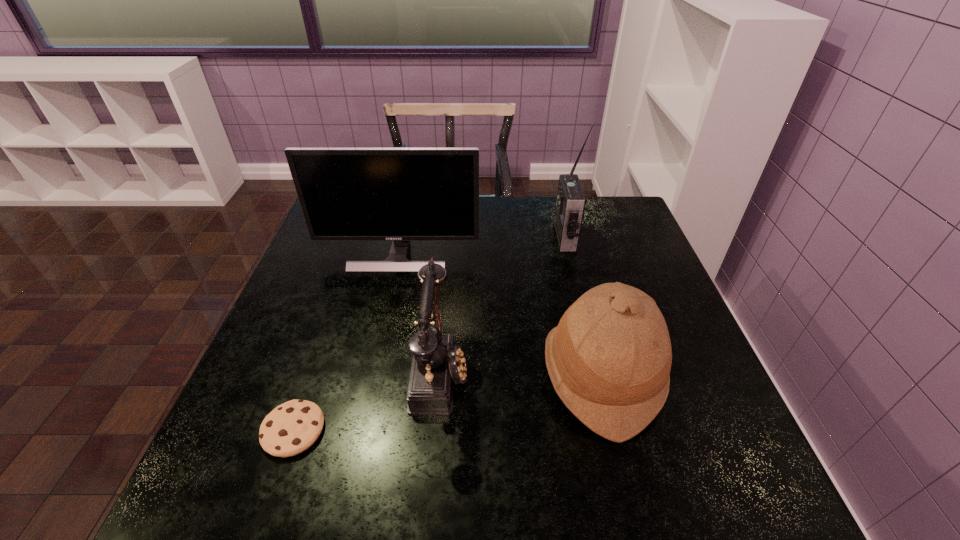
Find the location of a particular element. The image size is (960, 540). free space located 0.100m on the front-facing side of the hat is located at coordinates (495, 374).

The height and width of the screenshot is (540, 960). I want to click on vacant space located on the front-facing side of the hat, so click(500, 374).

At what (x,y) coordinates should I click in order to perform the action: click on vacant space situated 0.180m on the dial of the telephone. Please return your answer as a coordinate pair (x, y). Looking at the image, I should click on (553, 370).

The image size is (960, 540). I want to click on vacant space located 0.190m on the right of the cookie, so click(x=426, y=430).

Locate an element on the screen. This screenshot has width=960, height=540. radio receiver at the far edge is located at coordinates (570, 205).

Find the location of `monitor located in the far edge section of the desktop`. monitor located in the far edge section of the desktop is located at coordinates (400, 194).

The image size is (960, 540). I want to click on object situated at the near edge, so click(292, 427).

Locate an element on the screen. The image size is (960, 540). monitor that is positioned at the left edge is located at coordinates (400, 194).

Locate an element on the screen. The height and width of the screenshot is (540, 960). cookie present at the left edge is located at coordinates (292, 427).

Identify the location of object that is at the right edge. (609, 359).